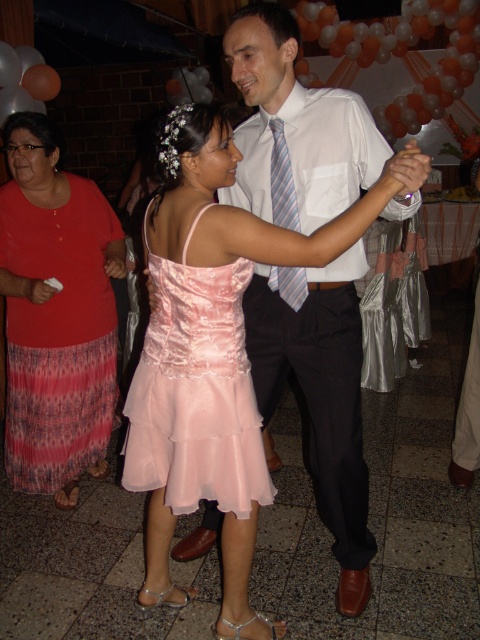
You are a photographer at the event and want to capture a photo of the pink pleated skirt at lower left and the white smooth dress shirt at center. Based on their positions, which object is closer to the bottom of the frame?

The pink pleated skirt at lower left is closer to the bottom of the frame because it is positioned below the white smooth dress shirt at center.

Consider the image. You are a photographer at the event and need to capture a photo of both the pink pleated skirt at lower left and the pink satin dress at center. Based on their widths, which one should you focus on first to ensure they both fit in the frame?

The pink pleated skirt at lower left might be wider than the pink satin dress at center, so focusing on the pink pleated skirt at lower left first would ensure both fit in the frame.